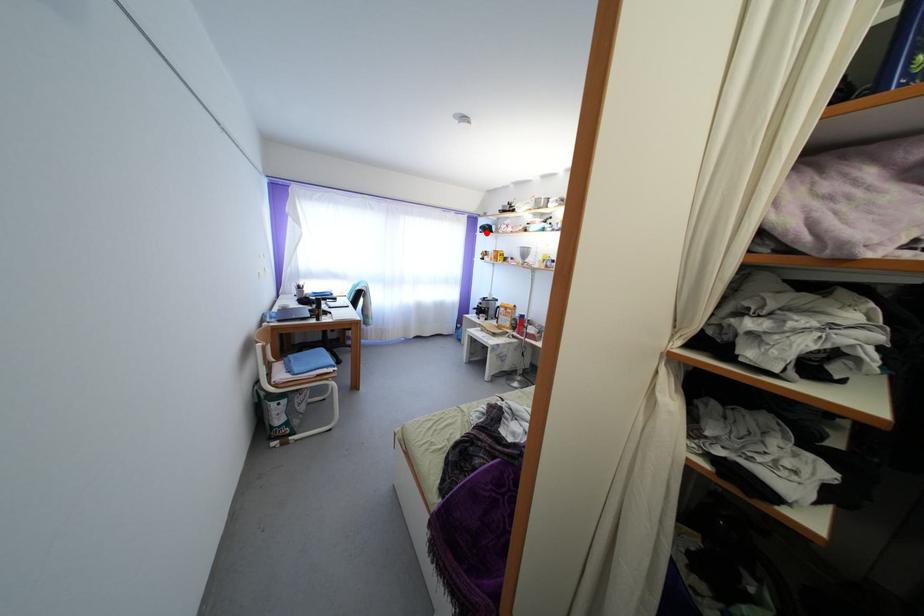
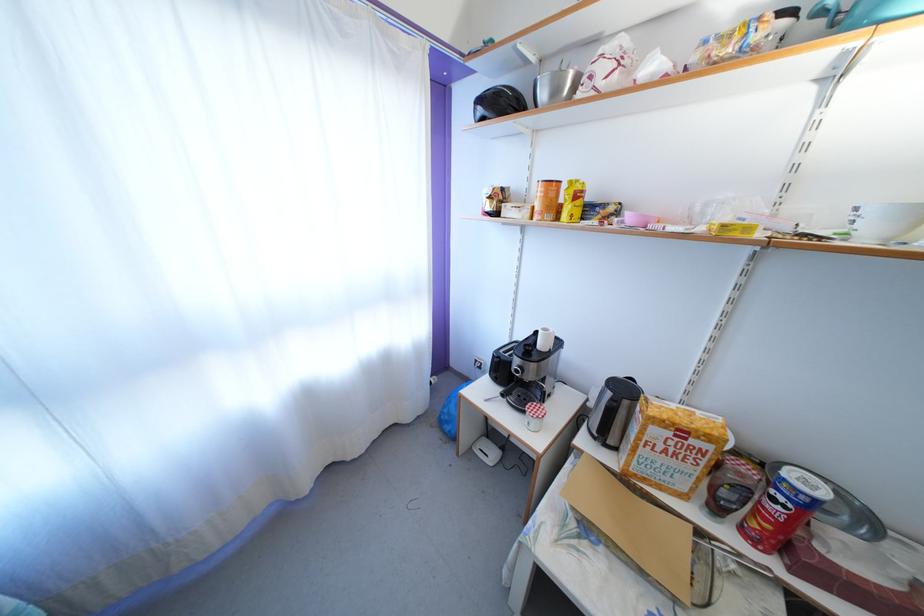
In the second image, find the point that corresponds to the highlighted location in the first image.

(484, 107)